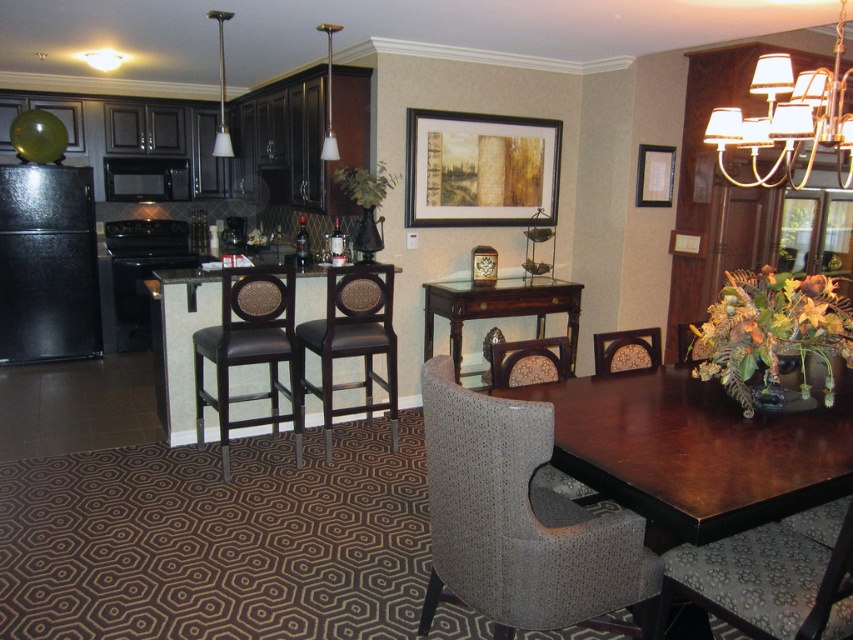
Between point (514, 420) and point (688, 332), which one is positioned in front?

Positioned in front is point (514, 420).

Describe the element at coordinates (520, 522) in the screenshot. The image size is (853, 640). I see `textured gray swivel chair at center` at that location.

Describe the element at coordinates (520, 522) in the screenshot. I see `textured gray swivel chair at center` at that location.

You are a GUI agent. You are given a task and a screenshot of the screen. Output one action in this format:
    pyautogui.click(x=<x>, y=<y>)
    Task: Click on the textured gray swivel chair at center
    
    Given the screenshot: What is the action you would take?
    pyautogui.click(x=520, y=522)

Who is taller, black matte refrigerator at left or textured gray armchair at lower right?

Standing taller between the two is black matte refrigerator at left.

Can you confirm if black matte refrigerator at left is positioned to the right of textured gray armchair at lower right?

In fact, black matte refrigerator at left is to the left of textured gray armchair at lower right.

Between point (1, 250) and point (567, 365), which one is positioned in front?

Point (567, 365)

Locate an element on the screen. This screenshot has width=853, height=640. black matte refrigerator at left is located at coordinates (47, 262).

Is black matte refrigerator at left taller than mahogany wood table at center?

Yes.

Which of these two, black matte refrigerator at left or mahogany wood table at center, stands taller?

black matte refrigerator at left

Between point (38, 342) and point (479, 298), which one is positioned in front?

Point (479, 298) is in front.

The width and height of the screenshot is (853, 640). I want to click on black matte refrigerator at left, so click(47, 262).